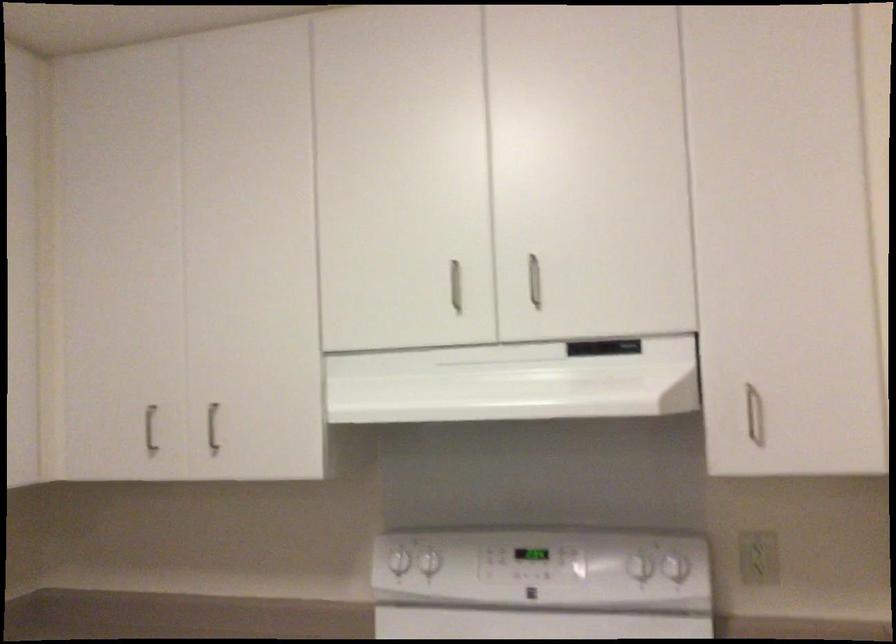
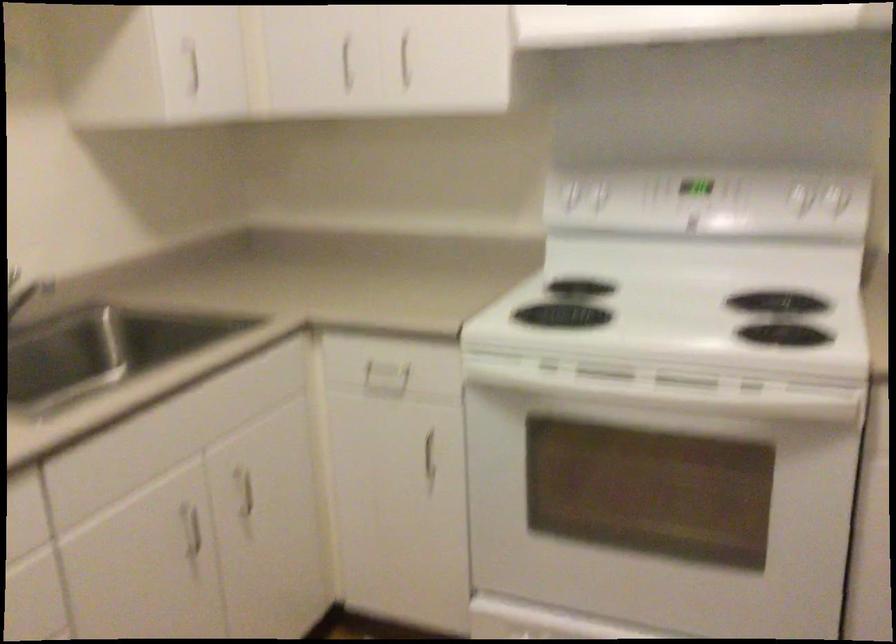
Looking at this image, which direction would the cameraman need to move to produce the second image?

The cameraman walked toward left, backward.